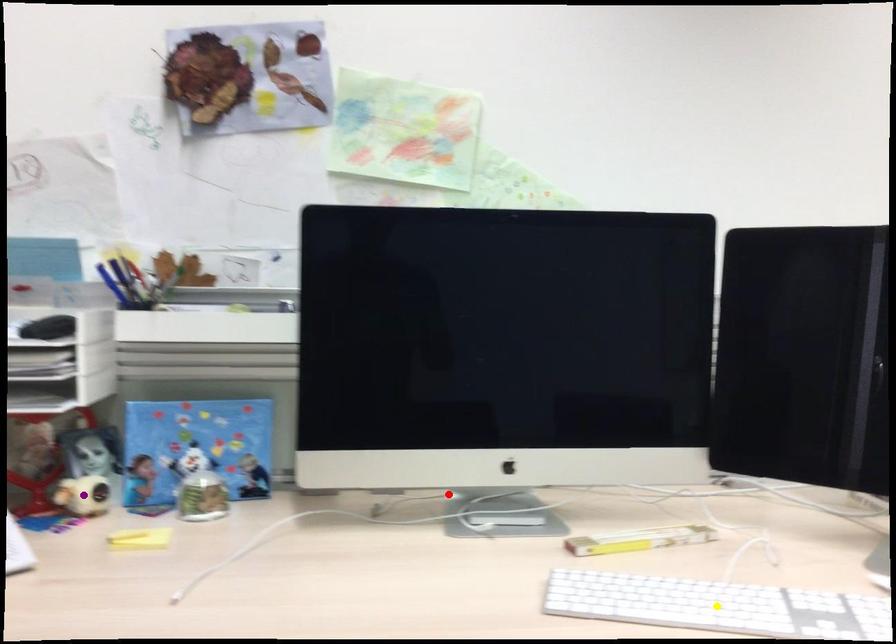
Order these from nearest to farthest:
- red point
- yellow point
- purple point

yellow point, purple point, red point